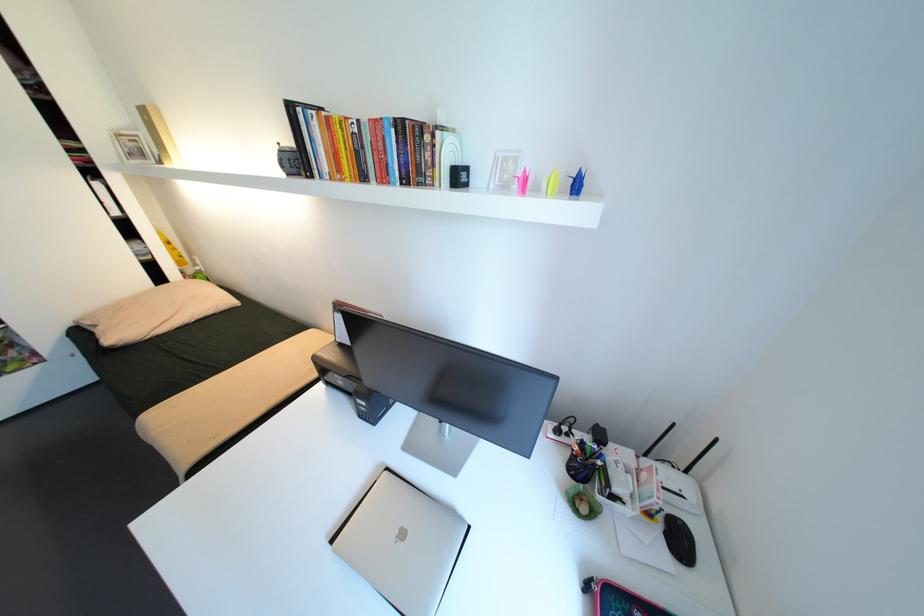
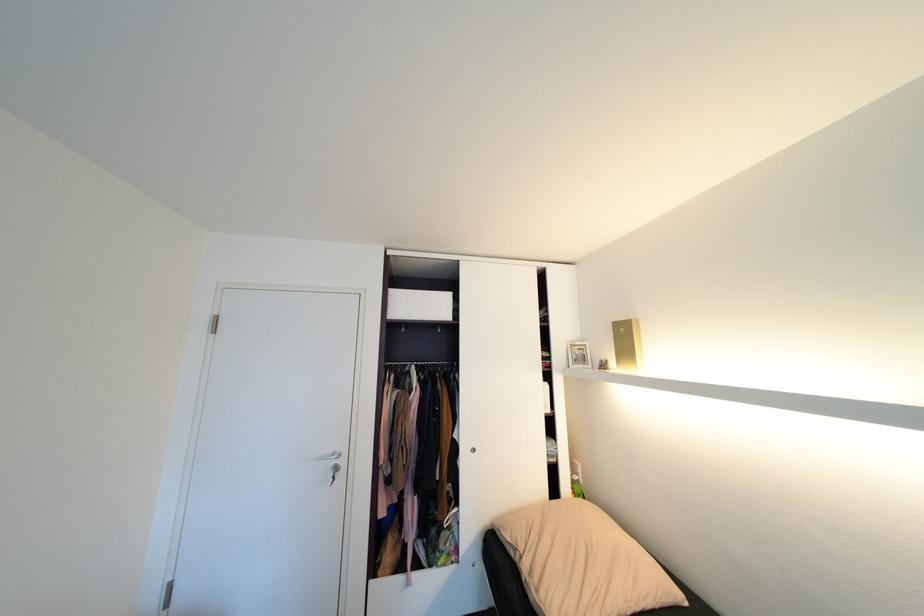
Find the pixel in the second image that matches point (100, 330) in the first image.

(518, 554)